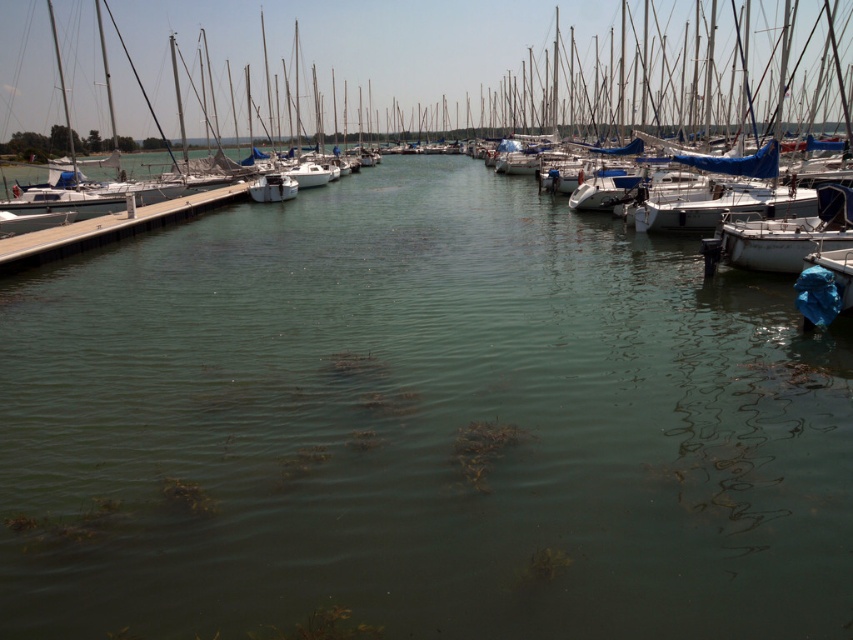
You are a visitor standing on the smooth wooden dock at left and want to board the white matte boat at center. Which direction should you move to reach the boat?

The smooth wooden dock at left is in front of the white matte boat at center, so you should move forward from the smooth wooden dock at left to reach the boat.

You are standing on the wooden pier at the left side of the marina and want to locate two specific points in the scene. The first point is labeled as point (25,262) and the second is point (259,188). Which of these two points is nearer to your current position on the wooden pier?

Point (25,262) is closer to the viewer than point (259,188), so the first point is nearer to your current position on the wooden pier.